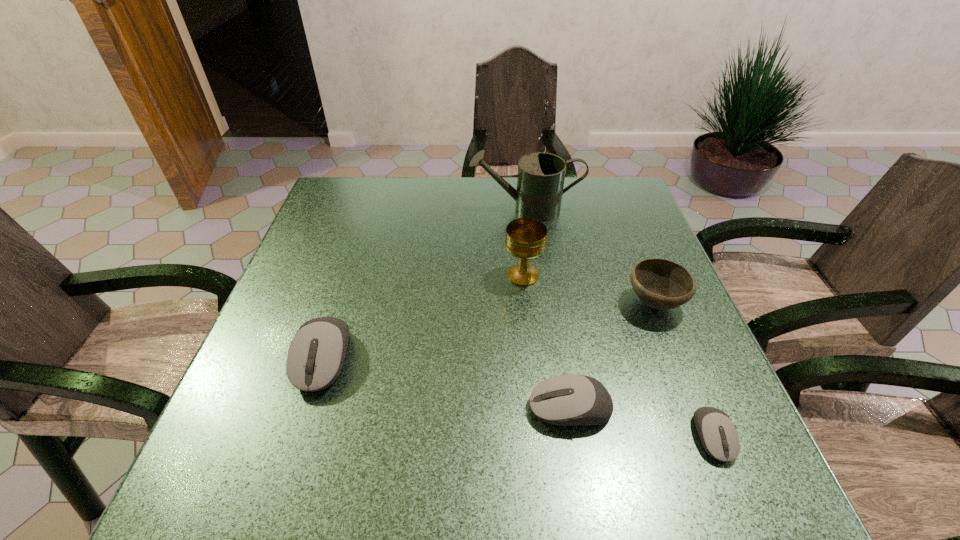
This screenshot has height=540, width=960. What are the coordinates of `free space at the near right corner of the desktop` in the screenshot? It's located at pos(653,396).

Where is `free spot between the fifth tallest object and the shortest computer equipment`? This screenshot has height=540, width=960. free spot between the fifth tallest object and the shortest computer equipment is located at coordinates (641, 423).

Where is `vacant area between the watering can and the bowl`? The width and height of the screenshot is (960, 540). vacant area between the watering can and the bowl is located at coordinates (589, 256).

The image size is (960, 540). I want to click on empty space that is in between the leftmost object and the fifth shortest object, so click(x=423, y=318).

This screenshot has width=960, height=540. Find the location of `vacant region between the tallest object and the leftmost object`. vacant region between the tallest object and the leftmost object is located at coordinates (424, 285).

Locate an element on the screen. free spot between the shortest object and the leftmost object is located at coordinates (518, 398).

Find the location of `free space between the fourth shortest object and the rightmost computer equipment`. free space between the fourth shortest object and the rightmost computer equipment is located at coordinates (684, 370).

Where is `free area in between the chalice and the rightmost computer equipment`? The image size is (960, 540). free area in between the chalice and the rightmost computer equipment is located at coordinates (617, 356).

This screenshot has width=960, height=540. In order to click on free space that is in between the farthest object and the rightmost computer equipment in this screenshot , I will do `click(619, 323)`.

What are the coordinates of `unoccupied position between the leftmost computer equipment and the chalice` in the screenshot? It's located at (423, 318).